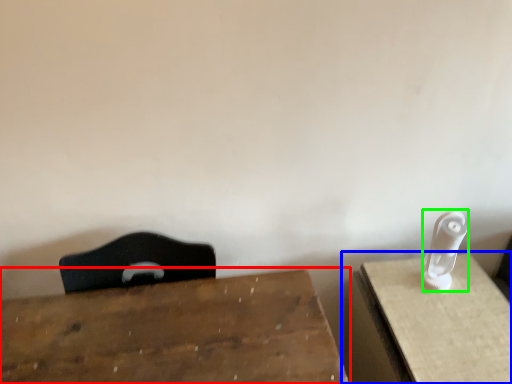
Question: Considering the real-world distances, which object is closest to table (highlighted by a red box)? table (highlighted by a blue box) or Wii controller (highlighted by a green box).

Choices:
 (A) table
 (B) Wii controller

Answer: (A)